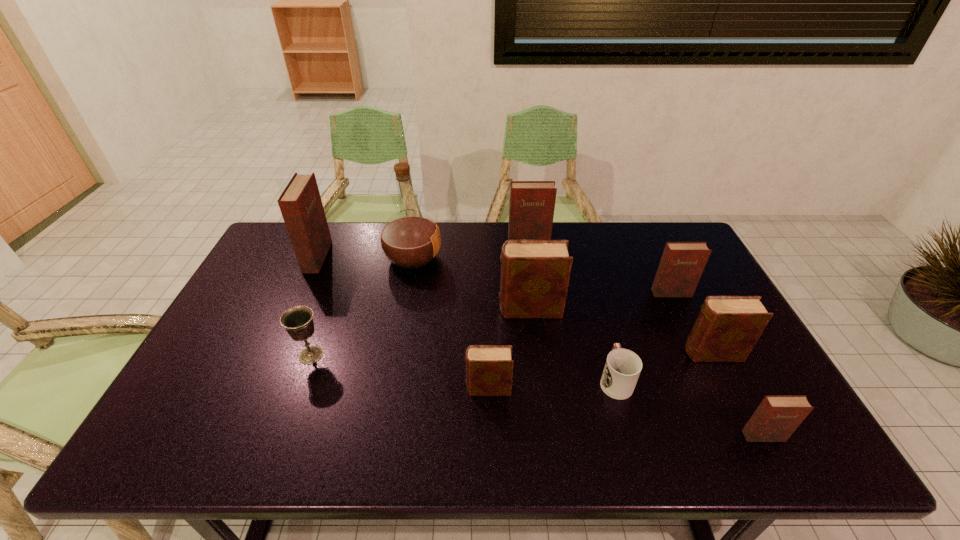
Locate an element on the screen. The image size is (960, 540). the second nearest brown diary is located at coordinates (727, 328).

This screenshot has height=540, width=960. Identify the location of chalice. (298, 321).

Where is `the second object from left to right`? the second object from left to right is located at coordinates (298, 321).

Where is `the nearest brown diary`? the nearest brown diary is located at coordinates coord(489,368).

In order to click on the second nearest diary in this screenshot , I will do `click(489, 368)`.

Locate an element on the screen. The height and width of the screenshot is (540, 960). the nearest diary is located at coordinates (776, 418).

In order to click on the smallest reddish-brown diary in this screenshot , I will do point(776,418).

Locate an element on the screen. the seventh object from left to right is located at coordinates (622, 368).

At what (x,y) coordinates should I click in order to perform the action: click on cup. Please return your answer as a coordinate pair (x, y). The width and height of the screenshot is (960, 540). Looking at the image, I should click on (622, 368).

Locate an element on the screen. The width and height of the screenshot is (960, 540). blank area located 0.360m on the front label of the pink liquor is located at coordinates (549, 258).